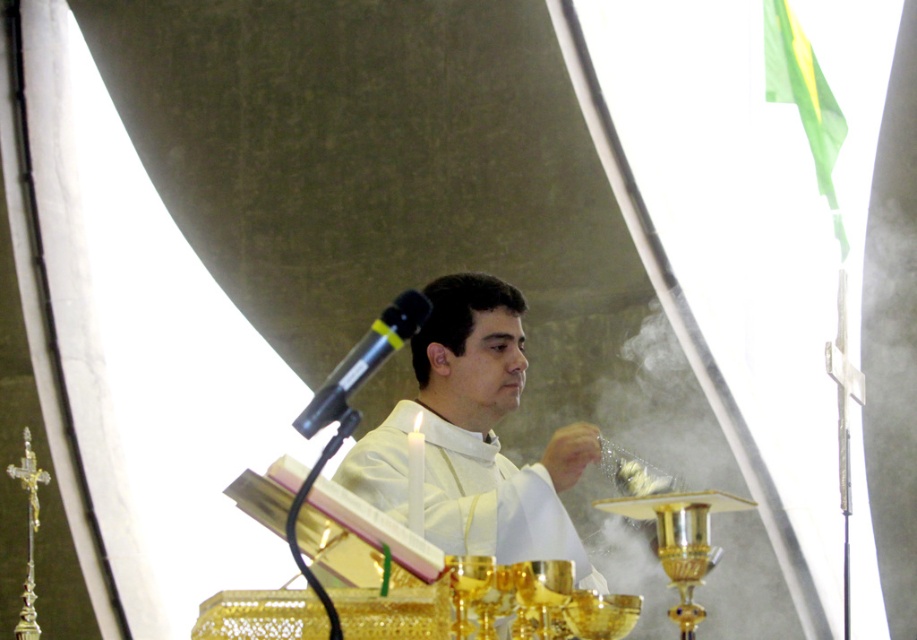
Does point (516, 381) come in front of point (319, 412)?

That is False.

Can you confirm if white matte/soft cloth at center is positioned to the left of black plastic microphone at upper center?

Incorrect, white matte/soft cloth at center is not on the left side of black plastic microphone at upper center.

I want to click on white matte/soft cloth at center, so coord(474,436).